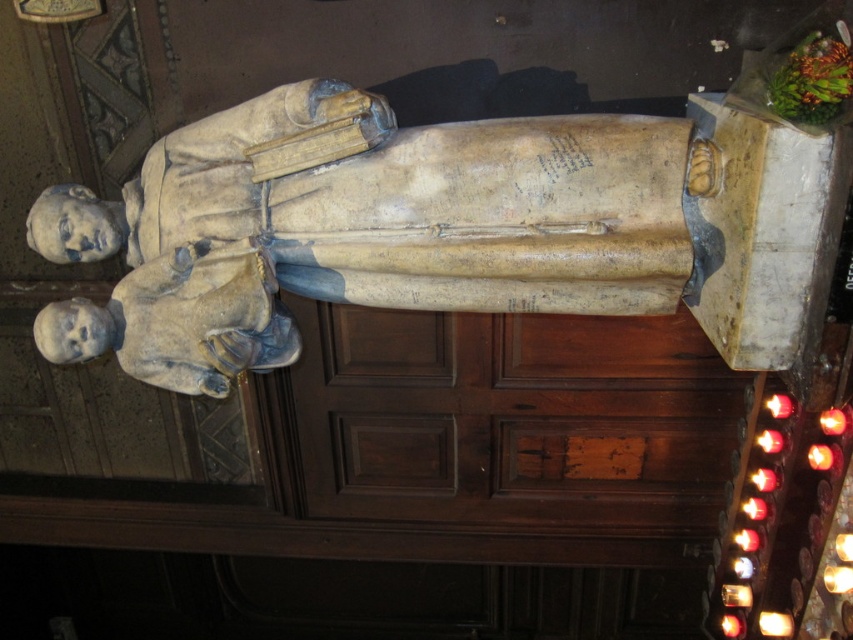
Who is higher up, beige stone statue at center or stone statue head at left?

Positioned higher is beige stone statue at center.

Is point (267, 216) less distant than point (189, 276)?

Yes, it is.

Is point (128, 188) positioned in front of point (45, 348)?

No, (128, 188) is further to viewer.

Locate an element on the screen. The width and height of the screenshot is (853, 640). beige stone statue at center is located at coordinates (373, 227).